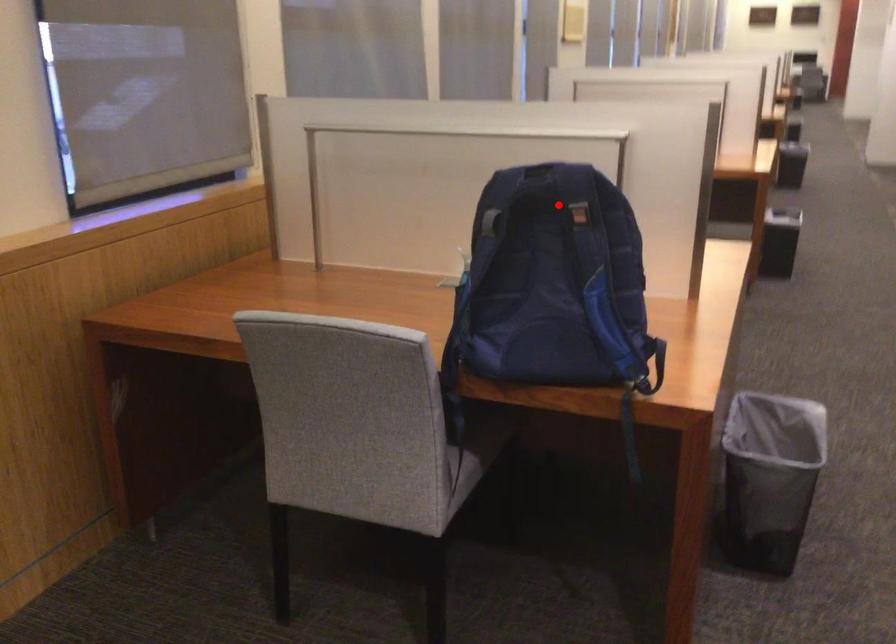
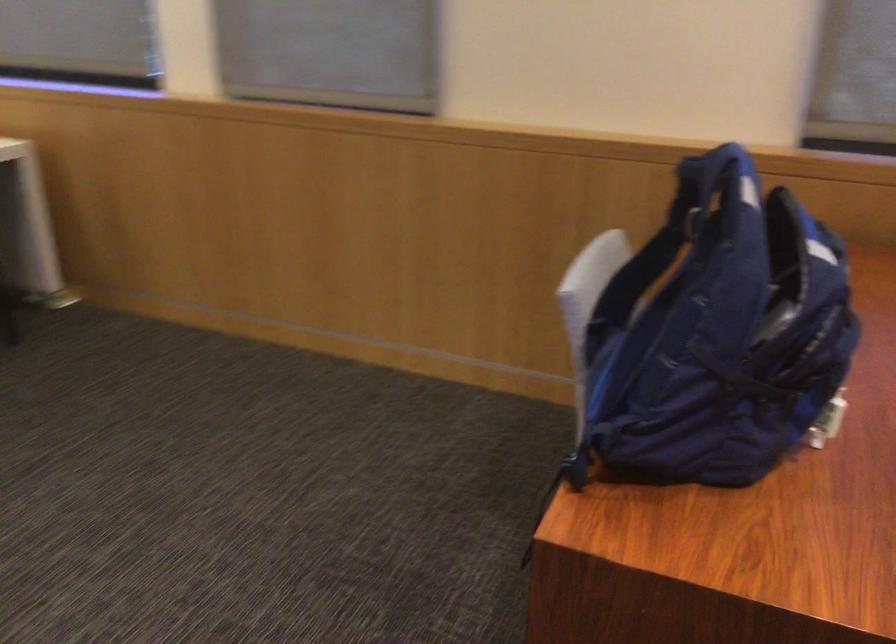
Locate, in the second image, the point that corresponds to the highlighted location in the first image.

(687, 216)